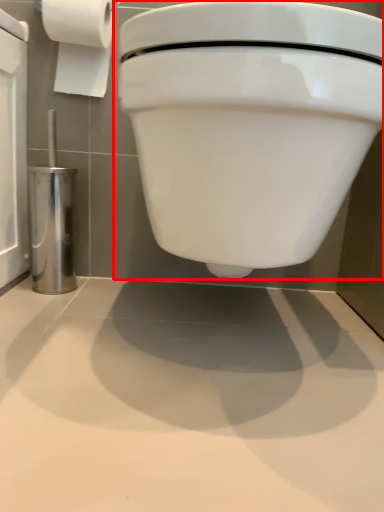
Question: From the image's perspective, where is toilet (annotated by the red box) located in relation to toilet paper in the image?

Choices:
 (A) below
 (B) above

Answer: (A)